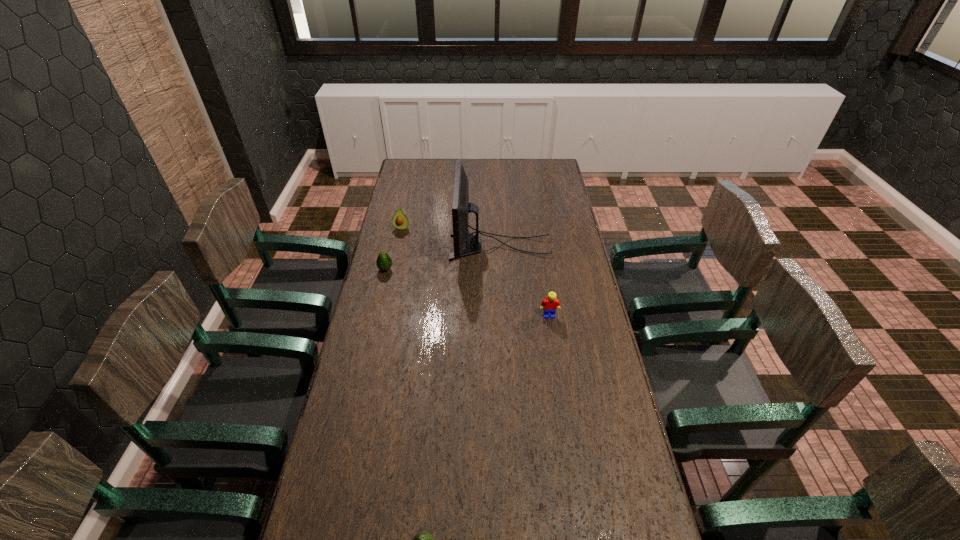
Where is `unoccupied position between the second nearest object and the tallest avocado`? unoccupied position between the second nearest object and the tallest avocado is located at coordinates (475, 272).

This screenshot has height=540, width=960. In order to click on the closest object to the rightmost avocado in this screenshot , I will do `click(550, 304)`.

The height and width of the screenshot is (540, 960). In order to click on object that is the fourth nearest to the second farthest avocado in this screenshot , I will do `click(423, 539)`.

Find the location of a particular element. The height and width of the screenshot is (540, 960). avocado that is the third nearest to the second nearest object is located at coordinates (423, 539).

The height and width of the screenshot is (540, 960). In order to click on avocado object that ranks as the second closest to the tallest avocado in this screenshot , I will do [x=423, y=539].

Identify the location of blank area in the image that satisfies the following two spatial constraints: 1. on the screen side of the tallest object; 2. on the front side of the second nearest avocado. (501, 269).